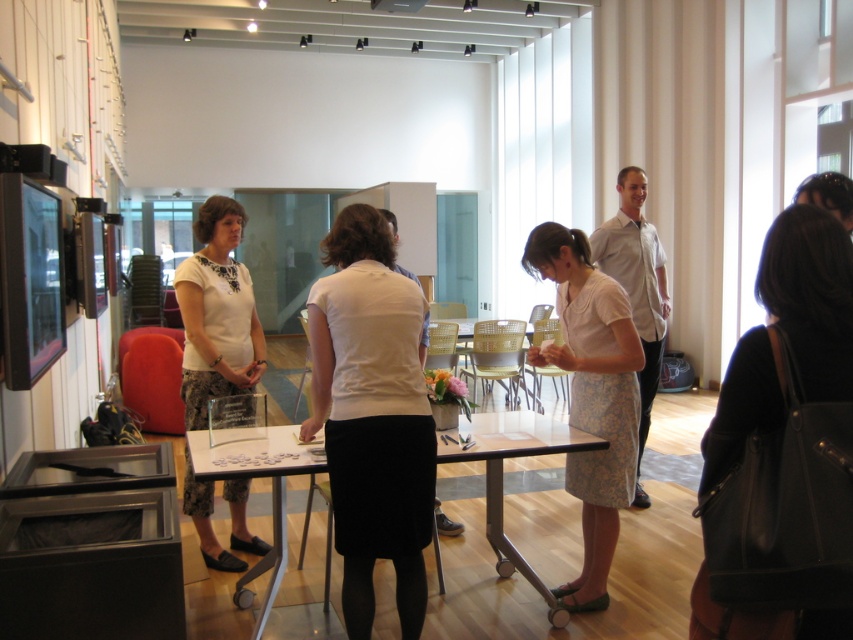
You are an event planner arranging a table for an upcoming art exhibition. You have a white matte blouse at center and a clear glass table at center. Based on the scene, which object is positioned to the left of the other?

The white matte blouse at center is to the left of the clear glass table at center according to the description.

You are an interior designer planning to rearrange the furniture in this gallery space. You need to place a large sculpture that requires a surface area of 1.2 square meters. Which object between the white matte skirt at center and the clear glass table at center would be more suitable for placing the sculpture?

The clear glass table at center is more suitable for placing the sculpture because it occupies more space than the white matte skirt at center, providing enough surface area to accommodate the sculpture.

You are an interior designer arranging a display in the gallery. You have a white matte skirt at center that needs to be placed on one of the tables. Based on its current position at point 0.652, 0.437, which table should it be placed on?

The white matte skirt at center is located at point (372, 417), so it should be placed on the table nearest to that coordinate.